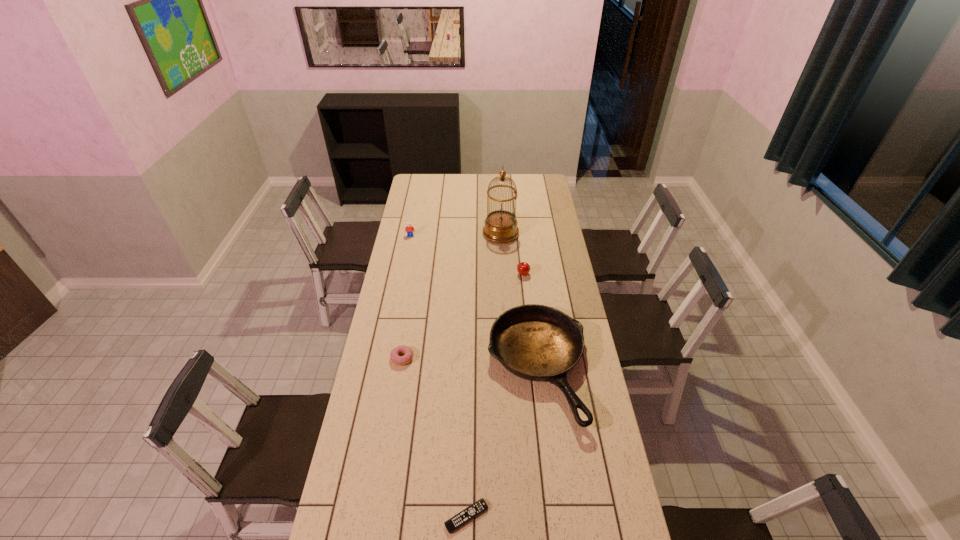
Find the location of a particular element. The height and width of the screenshot is (540, 960). free space located 0.220m on the face of the Lego is located at coordinates (405, 263).

Locate an element on the screen. The height and width of the screenshot is (540, 960). vacant space located 0.150m on the back of the fourth nearest object is located at coordinates (520, 251).

I want to click on free space located on the left of the frying pan, so click(460, 368).

Find the location of a particular element. Image resolution: width=960 pixels, height=540 pixels. vacant space located 0.350m on the right of the doughnut is located at coordinates (499, 358).

Image resolution: width=960 pixels, height=540 pixels. In order to click on vacant area located on the back of the remote control in this screenshot , I will do `click(468, 462)`.

The width and height of the screenshot is (960, 540). What are the coordinates of `Lego situated at the left edge` in the screenshot? It's located at (409, 228).

At what (x,y) coordinates should I click in order to perform the action: click on doughnut located in the left edge section of the desktop. Please return your answer as a coordinate pair (x, y). The height and width of the screenshot is (540, 960). Looking at the image, I should click on (394, 355).

Identify the location of object that is positioned at the right edge. (535, 342).

This screenshot has width=960, height=540. In order to click on vacant space at the far edge in this screenshot , I will do [x=458, y=186].

In the image, there is a desktop. Where is `vacant space at the left edge`? The image size is (960, 540). vacant space at the left edge is located at coordinates (398, 325).